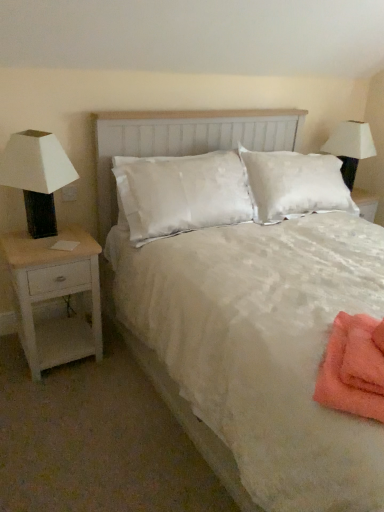
Describe the element at coordinates (55, 295) in the screenshot. The image size is (384, 512). I see `white wood nightstand at left` at that location.

Identify the location of white wood nightstand at left. (55, 295).

Measure the distance between point (57, 231) and camera.

The distance of point (57, 231) from camera is 2.21 meters.

This screenshot has height=512, width=384. I want to click on white wood nightstand at left, so click(x=55, y=295).

Is white satin bed at center thinner than orange towel at lower right?

No.

How different are the orientations of white satin bed at center and orange towel at lower right in degrees?

The facing directions of white satin bed at center and orange towel at lower right are 52 degrees apart.

Between white satin bed at center and orange towel at lower right, which one has less height?

orange towel at lower right.

Does white satin bed at center lie behind orange towel at lower right?

No, white satin bed at center is in front of orange towel at lower right.

Which point is more forward, (356, 122) or (89, 333)?

Positioned in front is point (89, 333).

Considering the sizes of objects white fabric lampshade at upper right and white wood nightstand at left in the image provided, who is taller, white fabric lampshade at upper right or white wood nightstand at left?

With more height is white wood nightstand at left.

Who is smaller, white fabric lampshade at upper right or white wood nightstand at left?

Smaller between the two is white fabric lampshade at upper right.

From the image's perspective, which one is positioned higher, white fabric lampshade at upper right or white wood nightstand at left?

white fabric lampshade at upper right, from the image's perspective.

Which object is positioned more to the right, white wood headboard at center or white wood nightstand at left?

white wood headboard at center.

Does white wood headboard at center have a larger size compared to white wood nightstand at left?

Correct, white wood headboard at center is larger in size than white wood nightstand at left.

From a real-world perspective, which is physically above, white wood headboard at center or white wood nightstand at left?

In real-world perspective, white wood headboard at center is above.

Does white wood headboard at center have a greater width compared to white wood nightstand at left?

No.

From a real-world perspective, which is physically above, white matte table lamp at left or white satin bed at center?

white matte table lamp at left.

Where is `bed that is below the white matte table lamp at left (from the image's perspective)`? This screenshot has height=512, width=384. bed that is below the white matte table lamp at left (from the image's perspective) is located at coordinates (182, 140).

Considering the relative positions of white matte table lamp at left and white satin bed at center in the image provided, is white matte table lamp at left to the left or to the right of white satin bed at center?

Clearly, white matte table lamp at left is on the left of white satin bed at center in the image.

Is white wood headboard at center not close to white matte table lamp at left?

No, white wood headboard at center is in close proximity to white matte table lamp at left.

Considering the sizes of white wood headboard at center and white matte table lamp at left in the image, is white wood headboard at center bigger or smaller than white matte table lamp at left?

In the image, white wood headboard at center appears to be larger than white matte table lamp at left.

Is white wood headboard at center to the left or to the right of white matte table lamp at left in the image?

From the image, it's evident that white wood headboard at center is to the right of white matte table lamp at left.

Which of these two, white wood headboard at center or white fabric lampshade at upper right, is smaller?

white fabric lampshade at upper right is smaller.

Can you confirm if white wood headboard at center is shorter than white fabric lampshade at upper right?

No.

Is white wood headboard at center oriented away from white fabric lampshade at upper right?

white wood headboard at center does not have its back to white fabric lampshade at upper right.

From the image's perspective, is white satin bed at center positioned above or below white matte table lamp at left?

Clearly, from the image's perspective, white satin bed at center is below white matte table lamp at left.

Which of these two, white satin bed at center or white matte table lamp at left, is bigger?

white satin bed at center is bigger.

Which object is positioned more to the left, white satin bed at center or white matte table lamp at left?

white matte table lamp at left.

This screenshot has width=384, height=512. In order to click on bed below the orange towel at lower right (from a real-world perspective) in this screenshot , I will do `click(182, 140)`.

Image resolution: width=384 pixels, height=512 pixels. Find the location of `lamp above the white wood nightstand at left (from a real-world perspective)`. lamp above the white wood nightstand at left (from a real-world perspective) is located at coordinates (350, 147).

Estimate the real-world distances between objects in this image. Which object is further from white satin bed at center, white matte table lamp at left or orange towel at lower right?

The object further to white satin bed at center is orange towel at lower right.

When comparing their distances from white matte table lamp at left, does white wood headboard at center or white fabric lampshade at upper right seem further?

white fabric lampshade at upper right is further to white matte table lamp at left.

Based on their spatial positions, is white matte table lamp at left or white wood nightstand at left further from orange towel at lower right?

Based on the image, white matte table lamp at left appears to be further to orange towel at lower right.

From the image, which object appears to be farther from white wood headboard at center, white satin bed at center or orange towel at lower right?

orange towel at lower right lies further to white wood headboard at center than the other object.

Based on their spatial positions, is white wood headboard at center or orange towel at lower right closer to white fabric lampshade at upper right?

Among the two, white wood headboard at center is located nearer to white fabric lampshade at upper right.

When comparing their distances from orange towel at lower right, does white wood headboard at center or white satin bed at center seem further?

white wood headboard at center is further to orange towel at lower right.

From the image, which object appears to be farther from orange towel at lower right, white matte table lamp at left or white wood headboard at center?

white wood headboard at center.

Based on their spatial positions, is orange towel at lower right or white wood nightstand at left further from white matte table lamp at left?

orange towel at lower right lies further to white matte table lamp at left than the other object.

Where is `table lamp between white satin bed at center and white fabric lampshade at upper right from front to back`? The height and width of the screenshot is (512, 384). table lamp between white satin bed at center and white fabric lampshade at upper right from front to back is located at coordinates (37, 176).

Image resolution: width=384 pixels, height=512 pixels. I want to click on headboard between orange towel at lower right and white fabric lampshade at upper right in the front-back direction, so pyautogui.click(x=183, y=140).

The height and width of the screenshot is (512, 384). Find the location of `headboard between white wood nightstand at left and white fabric lampshade at upper right from left to right`. headboard between white wood nightstand at left and white fabric lampshade at upper right from left to right is located at coordinates (183, 140).

Find the location of a particular element. The width and height of the screenshot is (384, 512). material between white satin bed at center and white fabric lampshade at upper right in the front-back direction is located at coordinates (354, 367).